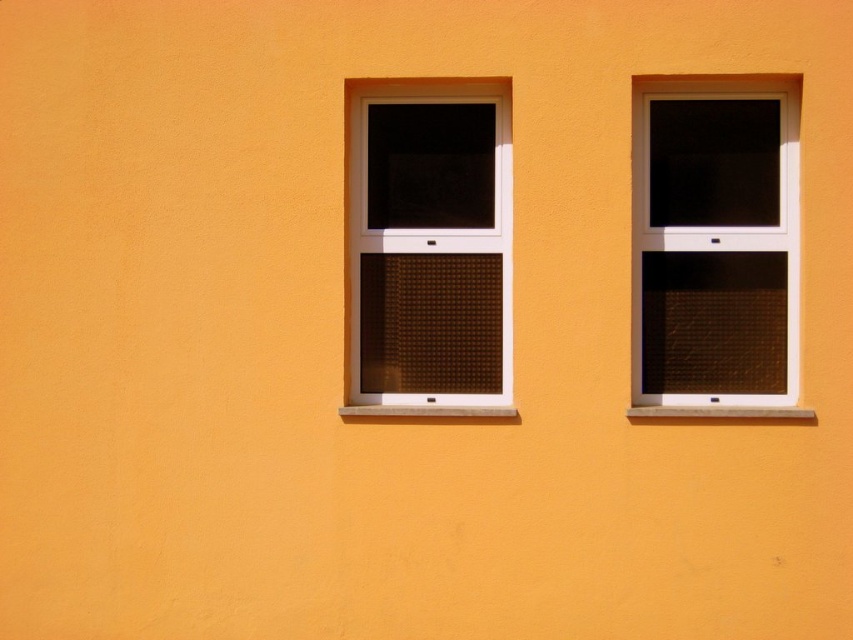
Based on the photo, can you confirm if matte white window at right is shorter than brown textured glass at center?

Yes.

Is matte white window at right bigger than brown textured glass at center?

Actually, matte white window at right might be smaller than brown textured glass at center.

Locate an element on the screen. matte white window at right is located at coordinates pyautogui.click(x=714, y=243).

Find the location of `matte white window at right`. matte white window at right is located at coordinates (714, 243).